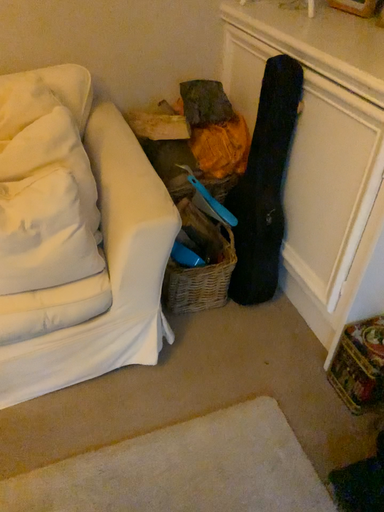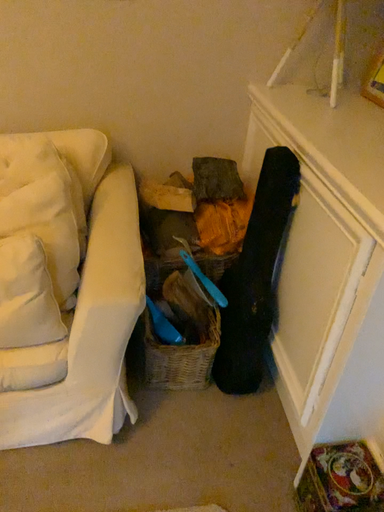
Question: How did the camera likely rotate when shooting the video?

Choices:
 (A) rotated left
 (B) rotated right

Answer: (A)